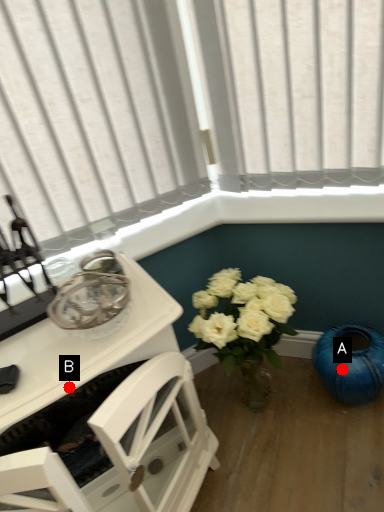
Question: Two points are circled on the image, labeled by A and B beside each circle. Which point appears farthest from the camera in this image?

Choices:
 (A) A is further
 (B) B is further

Answer: (A)